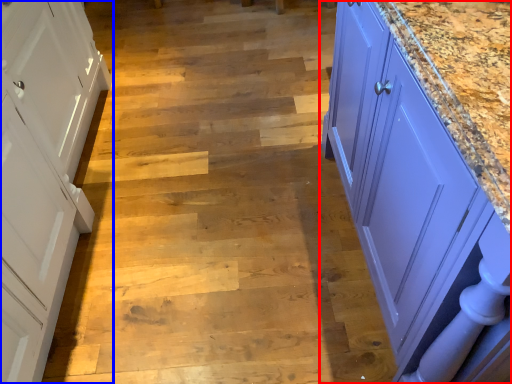
Question: Which object appears closest to the camera in this image, countertop (highlighted by a red box) or cabinetry (highlighted by a blue box)?

Choices:
 (A) countertop
 (B) cabinetry

Answer: (A)